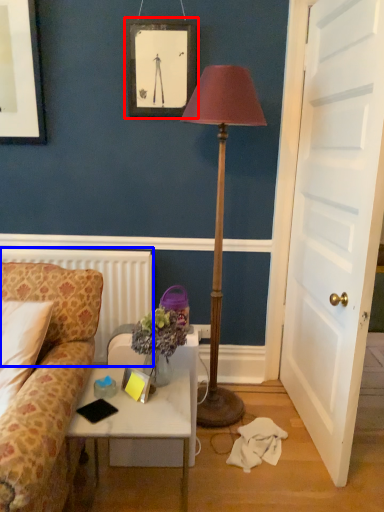
Question: Which object appears farthest to the camera in this image, picture frame (highlighted by a red box) or radiator (highlighted by a blue box)?

Choices:
 (A) picture frame
 (B) radiator

Answer: (B)